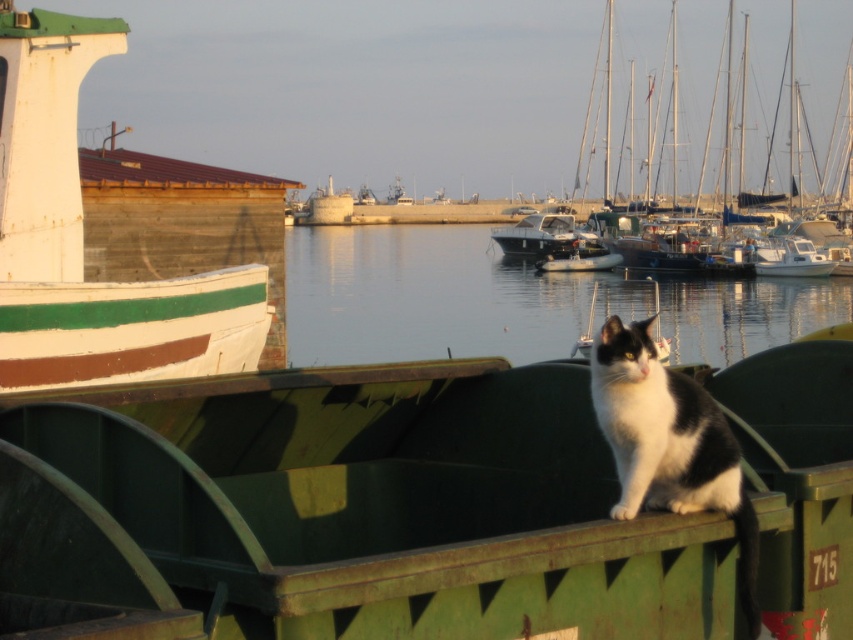
Question: Can you confirm if black and white fur cat at center is bigger than white glossy boat at center?

Choices:
 (A) yes
 (B) no

Answer: (B)

Question: Does black and white fur cat at center appear over white glossy boat at center?

Choices:
 (A) no
 (B) yes

Answer: (A)

Question: Is green matte boat at center bigger than white glossy sailboat at upper right?

Choices:
 (A) yes
 (B) no

Answer: (B)

Question: Which of these objects is positioned closest to the white matte boat at upper left?

Choices:
 (A) smooth water at center
 (B) white glossy sailboat at upper right

Answer: (A)

Question: Which object appears farthest from the camera in this image?

Choices:
 (A) white glossy boat at center
 (B) green matte boat at center
 (C) smooth water at center

Answer: (A)

Question: Considering the real-world distances, which object is closest to the black and white fur cat at center?

Choices:
 (A) white glossy boat at center
 (B) smooth water at center

Answer: (B)